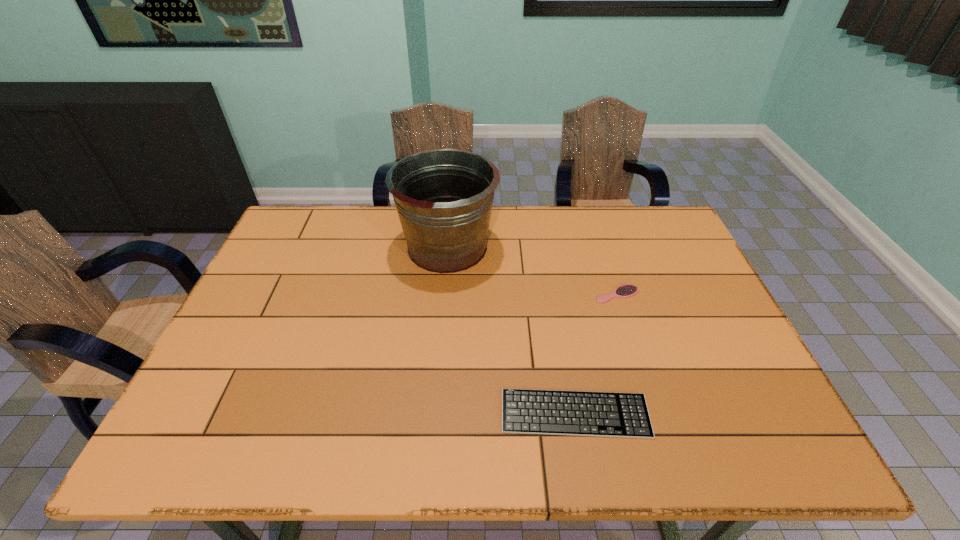
Where is `object present at the near edge`? object present at the near edge is located at coordinates (552, 412).

The height and width of the screenshot is (540, 960). Identify the location of vacant space at the far edge of the desktop. (405, 240).

In the image, there is a desktop. At what (x,y) coordinates should I click in order to perform the action: click on free region at the near edge. Please return your answer as a coordinate pair (x, y). The width and height of the screenshot is (960, 540). Looking at the image, I should click on (349, 449).

Locate an element on the screen. This screenshot has width=960, height=540. vacant space at the left edge of the desktop is located at coordinates (288, 311).

At what (x,y) coordinates should I click in order to perform the action: click on blank area at the right edge. Please return your answer as a coordinate pair (x, y). Looking at the image, I should click on (752, 372).

This screenshot has width=960, height=540. Identify the location of vacant space at the far left corner of the desktop. (311, 209).

This screenshot has height=540, width=960. In the image, there is a desktop. Identify the location of vacant space at the near left corner. 194,447.

The height and width of the screenshot is (540, 960). In the image, there is a desktop. What are the coordinates of `vacant space at the far right corner` in the screenshot? It's located at click(x=647, y=245).

Where is `unoccupied position between the tallest object and the nearest object`? unoccupied position between the tallest object and the nearest object is located at coordinates (511, 330).

Find the location of a particular element. The image size is (960, 540). unoccupied area between the farthest object and the second shortest object is located at coordinates (532, 271).